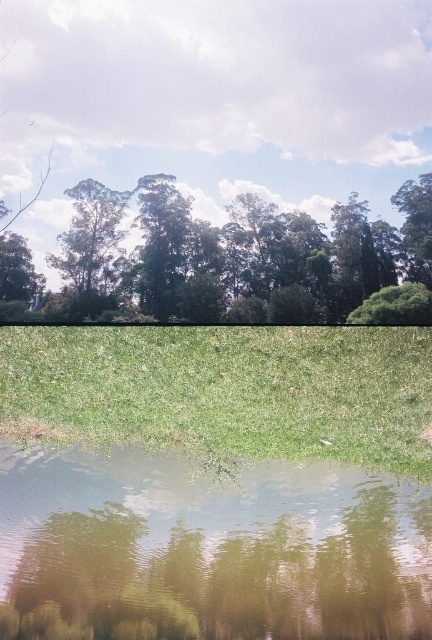
Question: Which point is closer to the camera taking this photo?

Choices:
 (A) (79, 234)
 (B) (387, 557)

Answer: (A)

Question: Which of the following is the farthest from the observer?

Choices:
 (A) green grass at lower center
 (B) green reflective water at lower center
 (C) green leafy tree at upper center

Answer: (B)

Question: Among these points, which one is farthest from the camera?

Choices:
 (A) (116, 440)
 (B) (107, 243)
 (C) (231, 561)

Answer: (C)

Question: Is green reflective water at lower center to the left of green grass at lower center from the viewer's perspective?

Choices:
 (A) yes
 (B) no

Answer: (A)

Question: Can you confirm if green grass at lower center is wider than green leafy tree at upper center?

Choices:
 (A) yes
 (B) no

Answer: (A)

Question: Considering the relative positions of green reflective water at lower center and green grass at lower center in the image provided, where is green reflective water at lower center located with respect to green grass at lower center?

Choices:
 (A) right
 (B) left

Answer: (B)